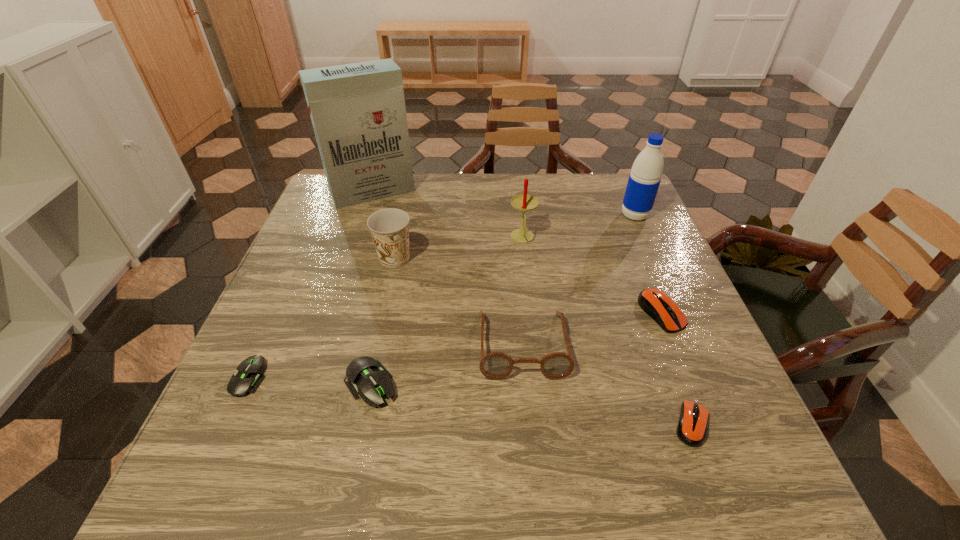
Identify the location of the bigger gray computer mouse. This screenshot has width=960, height=540. (364, 375).

The width and height of the screenshot is (960, 540). I want to click on the nearer orange computer mouse, so click(x=692, y=426).

What are the coordinates of `the left gray computer mouse` in the screenshot? It's located at (248, 378).

This screenshot has width=960, height=540. I want to click on the leftmost computer mouse, so click(x=248, y=378).

Where is `vacant region located on the right of the tallest object`? vacant region located on the right of the tallest object is located at coordinates (511, 192).

The width and height of the screenshot is (960, 540). I want to click on vacant space located 0.110m on the back of the water bottle, so pos(622,187).

Image resolution: width=960 pixels, height=540 pixels. What are the coordinates of `vacant space located 0.140m on the back of the candle` in the screenshot? It's located at (517, 200).

Locate an element on the screen. vacant region located on the left of the fourth tallest object is located at coordinates (303, 259).

Identify the location of vacant space located on the front-facing side of the spectacles. The width and height of the screenshot is (960, 540). (531, 441).

Identify the location of vacant space located 0.200m on the left of the farthest computer mouse. (550, 313).